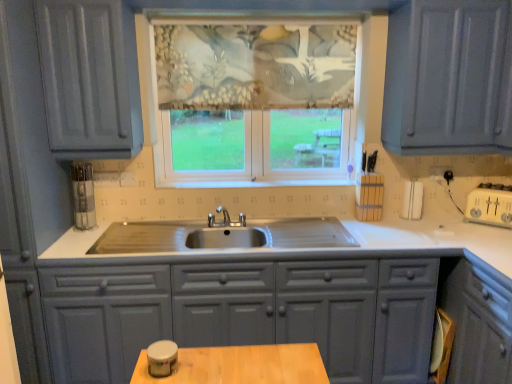
Question: From the image's perspective, is matte gray cabinets at center located beneath textured fabric window at center?

Choices:
 (A) no
 (B) yes

Answer: (B)

Question: Is matte gray cabinets at center oriented away from textured fabric window at center?

Choices:
 (A) yes
 (B) no

Answer: (B)

Question: Considering the relative sizes of matte gray cabinets at center and textured fabric window at center in the image provided, is matte gray cabinets at center bigger than textured fabric window at center?

Choices:
 (A) no
 (B) yes

Answer: (B)

Question: Can you confirm if matte gray cabinets at center is smaller than textured fabric window at center?

Choices:
 (A) no
 (B) yes

Answer: (A)

Question: Is matte gray cabinets at center thinner than textured fabric window at center?

Choices:
 (A) yes
 (B) no

Answer: (B)

Question: Does point (318, 105) appear closer or farther from the camera than point (415, 283)?

Choices:
 (A) closer
 (B) farther

Answer: (B)

Question: From the image's perspective, is textured floral fabric at center positioned above or below matte gray cabinets at center?

Choices:
 (A) above
 (B) below

Answer: (A)

Question: Considering the relative positions of textured floral fabric at center and matte gray cabinets at center in the image provided, is textured floral fabric at center to the left or to the right of matte gray cabinets at center?

Choices:
 (A) right
 (B) left

Answer: (A)

Question: From their relative heights in the image, would you say textured floral fabric at center is taller or shorter than matte gray cabinets at center?

Choices:
 (A) short
 (B) tall

Answer: (A)

Question: Is matte gray cabinets at center wider or thinner than textured floral fabric at center?

Choices:
 (A) thin
 (B) wide

Answer: (B)

Question: Considering the positions of point (56, 337) and point (189, 51), is point (56, 337) closer or farther from the camera than point (189, 51)?

Choices:
 (A) closer
 (B) farther

Answer: (A)

Question: Considering the positions of matte gray cabinets at center and textured floral fabric at center in the image, is matte gray cabinets at center bigger or smaller than textured floral fabric at center?

Choices:
 (A) small
 (B) big

Answer: (B)

Question: Is matte gray cabinets at center taller or shorter than textured floral fabric at center?

Choices:
 (A) tall
 (B) short

Answer: (A)

Question: In the image, is textured fabric window at center positioned in front of or behind textured floral fabric at center?

Choices:
 (A) front
 (B) behind

Answer: (A)

Question: Based on their positions, is textured fabric window at center located to the left or right of textured floral fabric at center?

Choices:
 (A) right
 (B) left

Answer: (A)